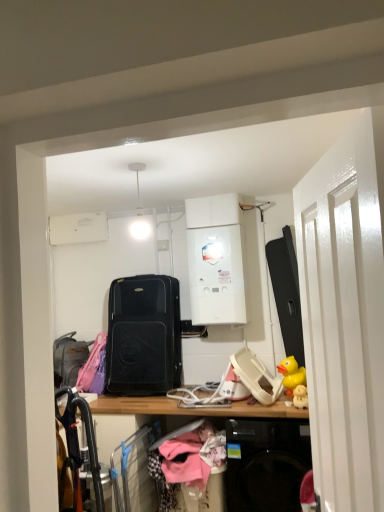
Question: From the image's perspective, relative to black matte suitcase at center, is gray fabric suitcase at left above or below?

Choices:
 (A) above
 (B) below

Answer: (B)

Question: In terms of size, does gray fabric suitcase at left appear bigger or smaller than black matte suitcase at center?

Choices:
 (A) small
 (B) big

Answer: (A)

Question: Estimate the real-world distances between objects in this image. Which object is closer to the white glossy door at right?

Choices:
 (A) pink fabric hanger at center
 (B) gray fabric suitcase at left
 (C) black matte suitcase at center
 (D) white glossy boiler at center
 (E) wooden desk at center

Answer: (E)

Question: Which object is positioned closest to the pink fabric hanger at center?

Choices:
 (A) black matte suitcase at center
 (B) white glossy door at right
 (C) yellow rubber duck at right
 (D) wooden desk at center
 (E) white glossy boiler at center

Answer: (D)